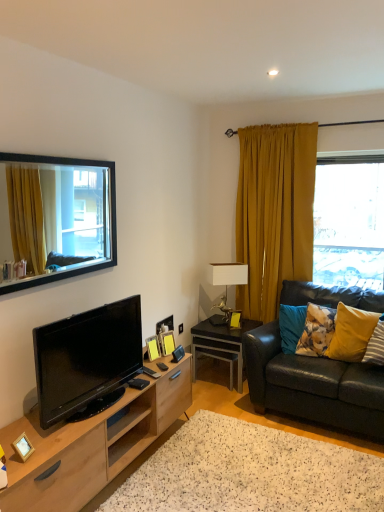
Question: Can you confirm if black glossy tv at lower left is thinner than black glossy side table at lower right?

Choices:
 (A) yes
 (B) no

Answer: (A)

Question: Considering the relative sizes of black glossy tv at lower left and black glossy side table at lower right in the image provided, is black glossy tv at lower left shorter than black glossy side table at lower right?

Choices:
 (A) no
 (B) yes

Answer: (A)

Question: Is black glossy tv at lower left wider than black glossy side table at lower right?

Choices:
 (A) yes
 (B) no

Answer: (B)

Question: Is black glossy tv at lower left to the right of black glossy side table at lower right from the viewer's perspective?

Choices:
 (A) yes
 (B) no

Answer: (B)

Question: Does black glossy tv at lower left have a greater height compared to black glossy side table at lower right?

Choices:
 (A) yes
 (B) no

Answer: (A)

Question: In the image, is yellow matte picture frame at center, the 1th picture frame viewed from the back, on the left side or the right side of black-framed mirror at upper left, which is the 1th window in front-to-back order?

Choices:
 (A) right
 (B) left

Answer: (A)

Question: In terms of size, does yellow matte picture frame at center, which is the 1th picture frame from right to left, appear bigger or smaller than black-framed mirror at upper left, the first window from the left?

Choices:
 (A) small
 (B) big

Answer: (A)

Question: From their relative heights in the image, would you say yellow matte picture frame at center, the fourth picture frame from the left, is taller or shorter than black-framed mirror at upper left, which is counted as the second window, starting from the back?

Choices:
 (A) tall
 (B) short

Answer: (B)

Question: Does point (238, 322) appear closer or farther from the camera than point (21, 157)?

Choices:
 (A) farther
 (B) closer

Answer: (A)

Question: Is white speckled rug at lower center wider or thinner than white ceramic lamp at center?

Choices:
 (A) wide
 (B) thin

Answer: (A)

Question: In terms of size, does white speckled rug at lower center appear bigger or smaller than white ceramic lamp at center?

Choices:
 (A) small
 (B) big

Answer: (B)

Question: In the image, is white speckled rug at lower center on the left side or the right side of white ceramic lamp at center?

Choices:
 (A) right
 (B) left

Answer: (A)

Question: In the image, is white speckled rug at lower center positioned in front of or behind white ceramic lamp at center?

Choices:
 (A) front
 (B) behind

Answer: (A)

Question: Looking at the image, does yellow fabric pillow at right, which is counted as the second pillow, starting from the right, seem bigger or smaller compared to black glossy side table at lower right?

Choices:
 (A) big
 (B) small

Answer: (B)

Question: From the image's perspective, is yellow fabric pillow at right, which is counted as the second pillow, starting from the right, above or below black glossy side table at lower right?

Choices:
 (A) above
 (B) below

Answer: (A)